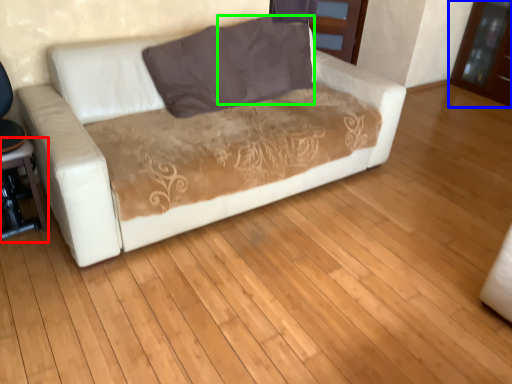
Question: Which object is positioned closest to table (highlighted by a red box)? Select from dresser (highlighted by a blue box) and pillow (highlighted by a green box).

Choices:
 (A) dresser
 (B) pillow

Answer: (B)